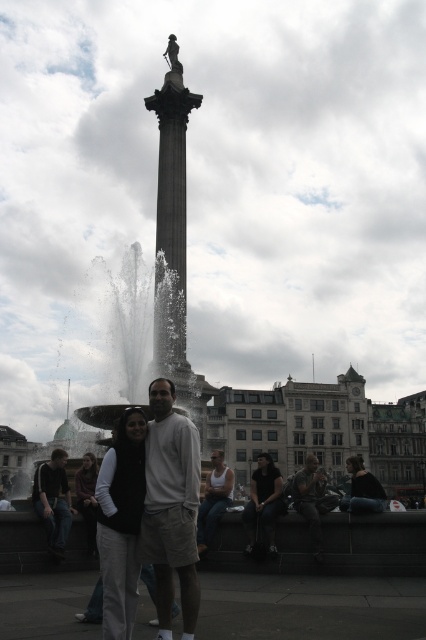
Question: Estimate the real-world distances between objects in this image. Which object is closer to the white tank top at center?

Choices:
 (A) dark brown leather jacket at lower left
 (B) dark brown leather jacket at lower right
 (C) white cotton shirt at center

Answer: (C)

Question: Which of the following is the closest to the observer?

Choices:
 (A) (261, 524)
 (B) (209, 392)

Answer: (A)

Question: Is white fleece jacket at center below dark brown leather jacket at lower left?

Choices:
 (A) yes
 (B) no

Answer: (B)

Question: Among these points, which one is farthest from the camera?

Choices:
 (A) (313, 492)
 (B) (106, 528)
 (C) (175, 541)

Answer: (A)

Question: Does white cotton shirt at center appear over dark brown leather jacket at lower left?

Choices:
 (A) no
 (B) yes

Answer: (B)

Question: Is white cotton shirt at center above dark blue jeans at lower center?

Choices:
 (A) yes
 (B) no

Answer: (A)